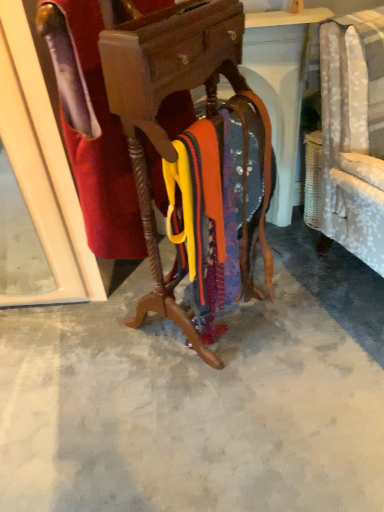
Measure the distance between point (125, 168) and camera.

3.86 feet.

Measure the distance between velvet red robe at center and camera.

They are 34.54 inches apart.

What is the approximate width of wooden coat rack at center?

It is 44.44 centimeters.

Where is `velvet red robe at center`? This screenshot has width=384, height=512. velvet red robe at center is located at coordinates (92, 129).

From the image's perspective, is velvet red robe at center over smooth concrete floor at center?

Yes, from the image's perspective, velvet red robe at center is over smooth concrete floor at center.

I want to click on concrete behind the velvet red robe at center, so click(201, 399).

How different are the orientations of velvet red robe at center and smooth concrete floor at center in degrees?

They differ by 123 degrees in their facing directions.

Is velvet red robe at center with smooth concrete floor at center?

No, velvet red robe at center is not touching smooth concrete floor at center.

Is smooth concrete floor at center completely or partially outside of wooden coat rack at center?

Yes, smooth concrete floor at center is located beyond the bounds of wooden coat rack at center.

Which object is closer to the camera, smooth concrete floor at center or wooden coat rack at center?

wooden coat rack at center is closer to the camera.

Is smooth concrete floor at center aimed at wooden coat rack at center?

No, smooth concrete floor at center is not facing towards wooden coat rack at center.

How different are the orientations of smooth concrete floor at center and wooden coat rack at center in degrees?

123 degrees.

Is smooth concrete floor at center in front of velvet red robe at center?

No, smooth concrete floor at center is behind velvet red robe at center.

From the image's perspective, who appears lower, smooth concrete floor at center or velvet red robe at center?

smooth concrete floor at center, from the image's perspective.

Based on the photo, is smooth concrete floor at center shorter than velvet red robe at center?

Correct, smooth concrete floor at center is not as tall as velvet red robe at center.

Considering the sizes of objects smooth concrete floor at center and velvet red robe at center in the image provided, who is bigger, smooth concrete floor at center or velvet red robe at center?

smooth concrete floor at center.

Is wooden coat rack at center completely or partially inside velvet red robe at center?

No, wooden coat rack at center is located outside of velvet red robe at center.

From a real-world perspective, is velvet red robe at center positioned above or below wooden coat rack at center?

Clearly, from a real-world perspective, velvet red robe at center is above wooden coat rack at center.

Considering the positions of objects velvet red robe at center and wooden coat rack at center in the image provided, who is more to the left, velvet red robe at center or wooden coat rack at center?

velvet red robe at center.

Could you tell me if wooden coat rack at center is facing velvet red robe at center?

Yes, wooden coat rack at center is facing velvet red robe at center.

Is point (234, 286) positioned before point (77, 152)?

That is False.

Is there a large distance between wooden coat rack at center and velvet red robe at center?

No, there isn't a large distance between wooden coat rack at center and velvet red robe at center.

Consider the image. Does wooden coat rack at center have a larger size compared to velvet red robe at center?

Yes, wooden coat rack at center is bigger than velvet red robe at center.

Which object is further away from the camera taking this photo, wooden coat rack at center or smooth concrete floor at center?

smooth concrete floor at center is further from the camera.

Does point (170, 311) come closer to viewer compared to point (213, 445)?

No.

From the image's perspective, which object appears higher, wooden coat rack at center or smooth concrete floor at center?

From the image's view, wooden coat rack at center is above.

The width and height of the screenshot is (384, 512). I want to click on robe on the left side of smooth concrete floor at center, so click(92, 129).

In order to click on concrete that is on the right side of wooden coat rack at center in this screenshot , I will do `click(201, 399)`.

Which object lies nearer to the anchor point smooth concrete floor at center, wooden coat rack at center or velvet red robe at center?

wooden coat rack at center is positioned closer to the anchor smooth concrete floor at center.

Considering their positions, is wooden coat rack at center positioned closer to velvet red robe at center than smooth concrete floor at center?

The object closer to velvet red robe at center is wooden coat rack at center.

Which object lies further to the anchor point wooden coat rack at center, velvet red robe at center or smooth concrete floor at center?

The object further to wooden coat rack at center is smooth concrete floor at center.

From the image, which object appears to be farther from smooth concrete floor at center, velvet red robe at center or wooden coat rack at center?

velvet red robe at center is further to smooth concrete floor at center.

Estimate the real-world distances between objects in this image. Which object is closer to wooden coat rack at center, smooth concrete floor at center or velvet red robe at center?

velvet red robe at center is positioned closer to the anchor wooden coat rack at center.

Looking at the image, which one is located further to velvet red robe at center, smooth concrete floor at center or wooden coat rack at center?

smooth concrete floor at center is further to velvet red robe at center.

I want to click on furniture between velvet red robe at center and smooth concrete floor at center vertically, so click(196, 158).